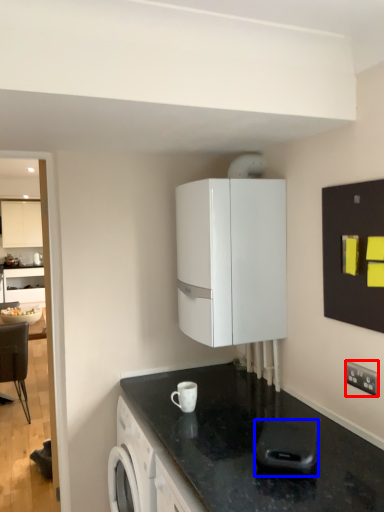
Question: Which point is further to the camera, electric outlet (highlighted by a red box) or appliance (highlighted by a blue box)?

Choices:
 (A) electric outlet
 (B) appliance

Answer: (A)